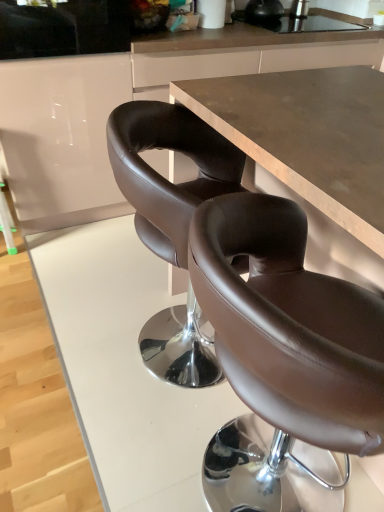
You are a GUI agent. You are given a task and a screenshot of the screen. Output one action in this format:
    pyautogui.click(x=<x>, y=<y>)
    Task: Click on the vacant region below brown leather chair at center (from a real-world perspective)
    
    Given the screenshot: What is the action you would take?
    pyautogui.click(x=225, y=467)